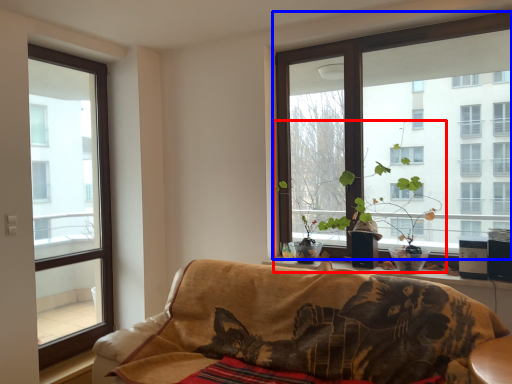
Question: Which point is closer to the camera, houseplant (highlighted by a red box) or window (highlighted by a blue box)?

Choices:
 (A) houseplant
 (B) window

Answer: (B)